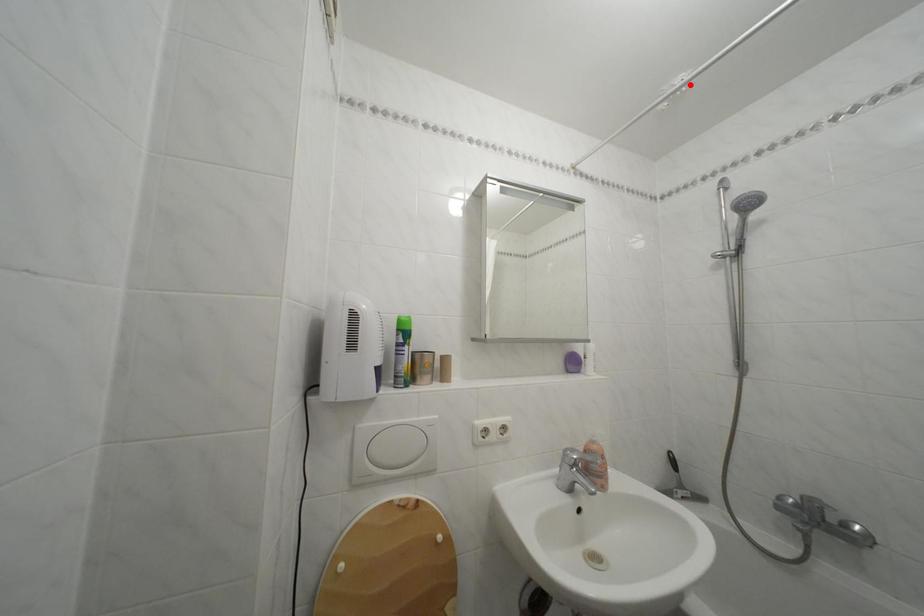
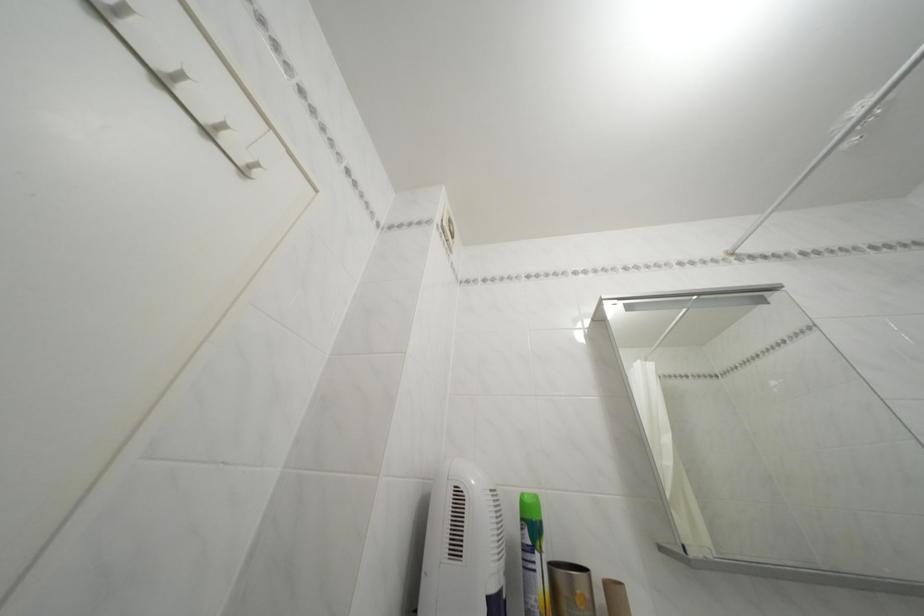
Where in the second image is the point corresponding to the highlighted location from the first image?

(869, 114)